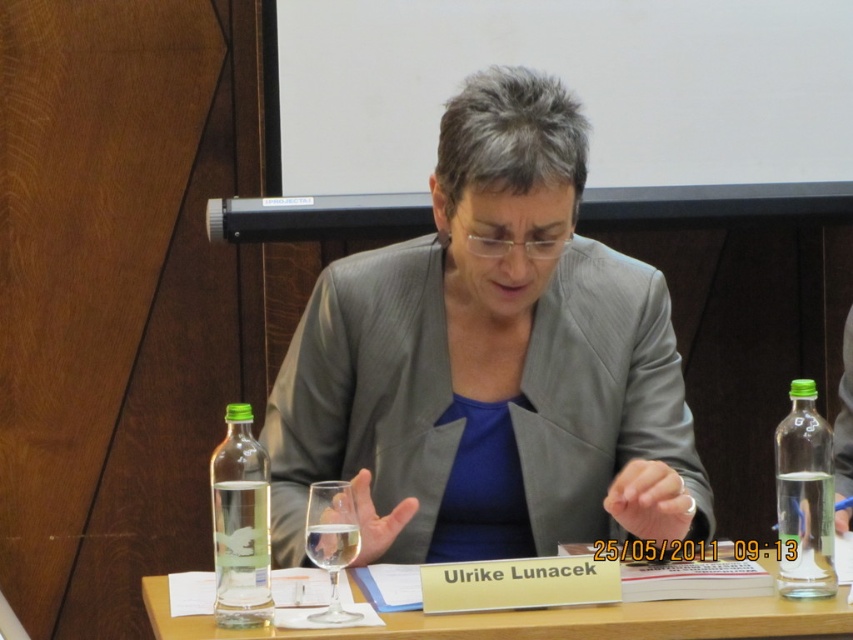
You are taking a photo of the table and want to focus on both point A at point [651,625] and point B at point [344,506]. Which point should you adjust your focus to first to ensure both are in focus?

Point A at point [651,625] should be focused first because it is closer to the camera than point B at point [344,506], allowing the depth of field to cover both points effectively.

You are organizing a small event and need to place a decorative centerpiece on the wooden table at center. Considering the clear glass wine glass at center is already on the table, will the table have enough space for the centerpiece?

The wooden table at center has a larger size compared to the clear glass wine glass at center, so there should be enough space to place a decorative centerpiece alongside the wine glass.